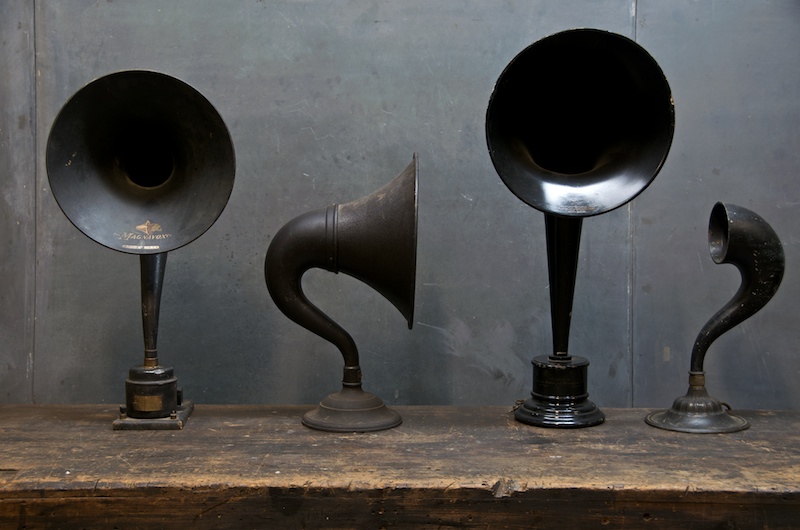
What are the coordinates of `edge of rustic wood table` in the screenshot? It's located at (26, 507), (310, 511), (594, 507), (730, 515).